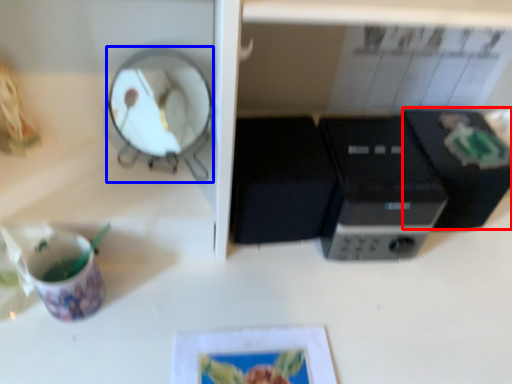
Question: Which object appears farthest to the camera in this image, appliance (highlighted by a red box) or mirror (highlighted by a blue box)?

Choices:
 (A) appliance
 (B) mirror

Answer: (A)